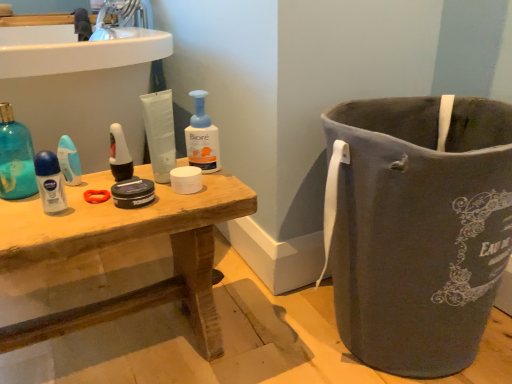
Identify the location of vacant space in front of white matte toilet paper at center. The height and width of the screenshot is (384, 512). (160, 203).